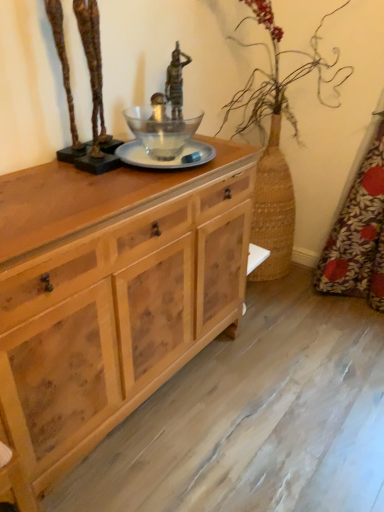
You are a GUI agent. You are given a task and a screenshot of the screen. Output one action in this format:
    pyautogui.click(x=<x>, y=<y>)
    Task: Click on the free point to the left of floral fabric at right
    
    Given the screenshot: What is the action you would take?
    pyautogui.click(x=312, y=310)